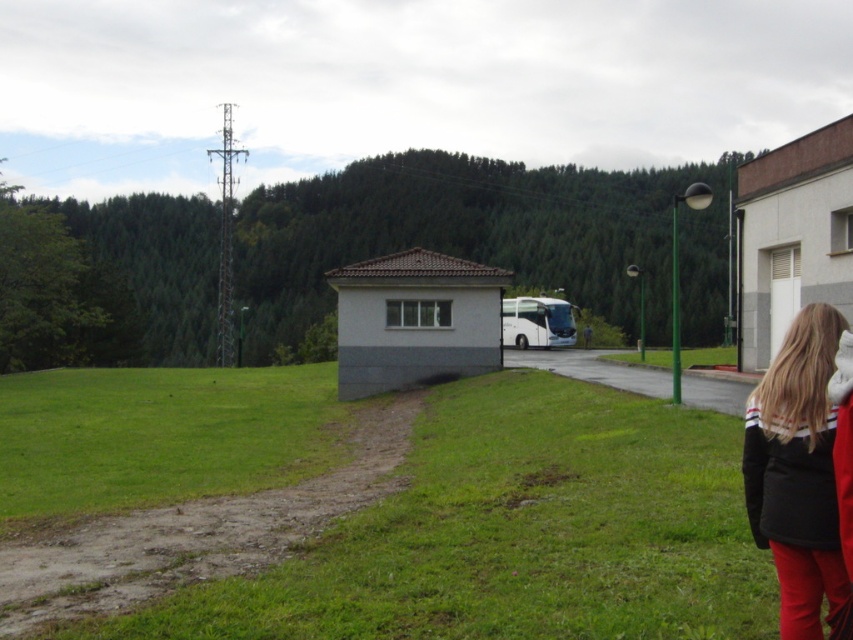
You are a hiker who just arrived at the guardhouse. You need to place your black fleece jacket at lower right into your backpack which is near the white glossy bus at center. Can you walk directly to the bus without any obstacles?

The black fleece jacket at lower right and white glossy bus at center are 56.74 meters apart from each other, so yes, you can walk directly to the bus without any obstacles since there is enough distance between them.

You are standing at the center of the image and want to pick up the black fleece jacket at lower right. In which direction should you move relative to the electrical tower on the left side?

The black fleece jacket at lower right is located at point (798, 470). Since the electrical tower is on the left side, you should move towards the right and slightly downward to reach the jacket.

You are a hiker who has just arrived at the guardhouse. You see the black fleece jacket at lower right and the white glossy bus at center. Which object is closer to the ground?

The black fleece jacket at lower right is positioned under the white glossy bus at center, so it is closer to the ground.